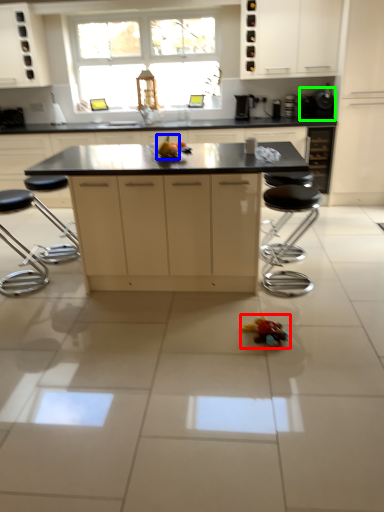
Question: Estimate the real-world distances between objects in this image. Which object is farther from toy (highlighted by a red box), food (highlighted by a blue box) or appliance (highlighted by a green box)?

Choices:
 (A) food
 (B) appliance

Answer: (B)